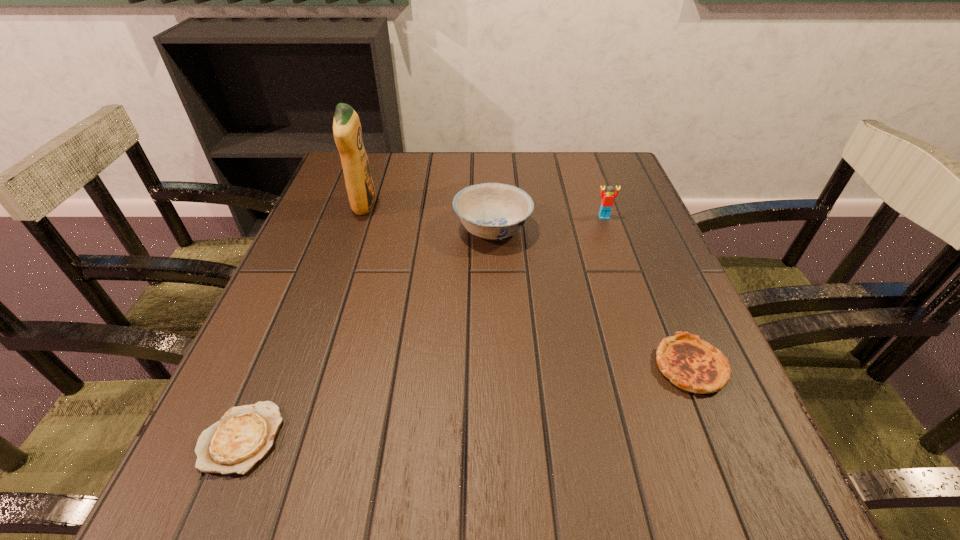
The image size is (960, 540). I want to click on vacant space that satisfies the following two spatial constraints: 1. on the label of the tallest object; 2. on the back side of the bowl, so (356, 228).

This screenshot has width=960, height=540. I want to click on free space in the image that satisfies the following two spatial constraints: 1. on the face of the Lego; 2. on the right side of the right quiche, so click(657, 367).

In order to click on vacant area in the image that satisfies the following two spatial constraints: 1. on the face of the Lego; 2. on the right side of the farther quiche in this screenshot , I will do `click(657, 367)`.

At what (x,y) coordinates should I click in order to perform the action: click on vacant space that satisfies the following two spatial constraints: 1. on the face of the fourth tallest object; 2. on the left side of the Lego. Please return your answer as a coordinate pair (x, y). The height and width of the screenshot is (540, 960). Looking at the image, I should click on (657, 367).